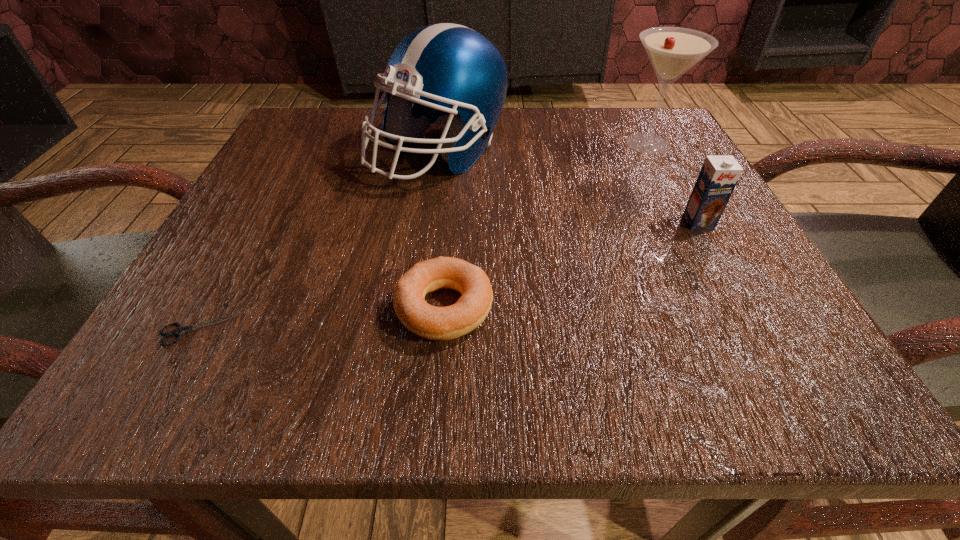
Identify the location of football helmet. (452, 75).

You are a GUI agent. You are given a task and a screenshot of the screen. Output one action in this format:
    pyautogui.click(x=<x>, y=<y>)
    Task: Click on the martini
    This screenshot has width=960, height=540.
    Given the screenshot: What is the action you would take?
    pyautogui.click(x=672, y=51)

The image size is (960, 540). Find the location of `chocolate milk`. chocolate milk is located at coordinates (719, 175).

This screenshot has width=960, height=540. What are the coordinates of `the third shortest object` in the screenshot? It's located at (719, 175).

Where is `bagel`? The width and height of the screenshot is (960, 540). bagel is located at coordinates (430, 322).

This screenshot has height=540, width=960. Find the location of `the shortest object`. the shortest object is located at coordinates (181, 330).

Locate an element on the screen. shears is located at coordinates (181, 330).

The image size is (960, 540). Find the location of `free space located at the front of the football helmet with the faceguard`. free space located at the front of the football helmet with the faceguard is located at coordinates (421, 290).

Image resolution: width=960 pixels, height=540 pixels. I want to click on vacant space located on the front of the martini, so click(696, 235).

At what (x,y) coordinates should I click in order to perform the action: click on free space located 0.090m on the front label of the third shortest object. Please return your answer as a coordinate pair (x, y). The image size is (960, 540). Looking at the image, I should click on (727, 274).